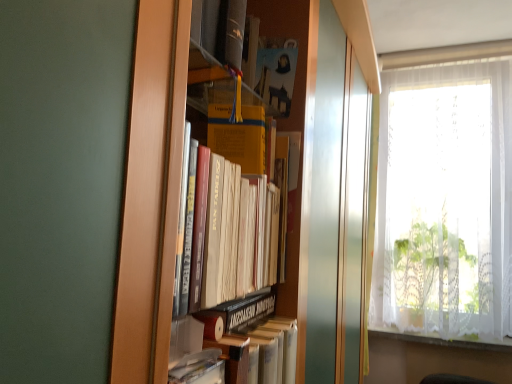
Find the location of a particular element. free space above hardcover book at center (from a real-world perspective) is located at coordinates (218, 339).